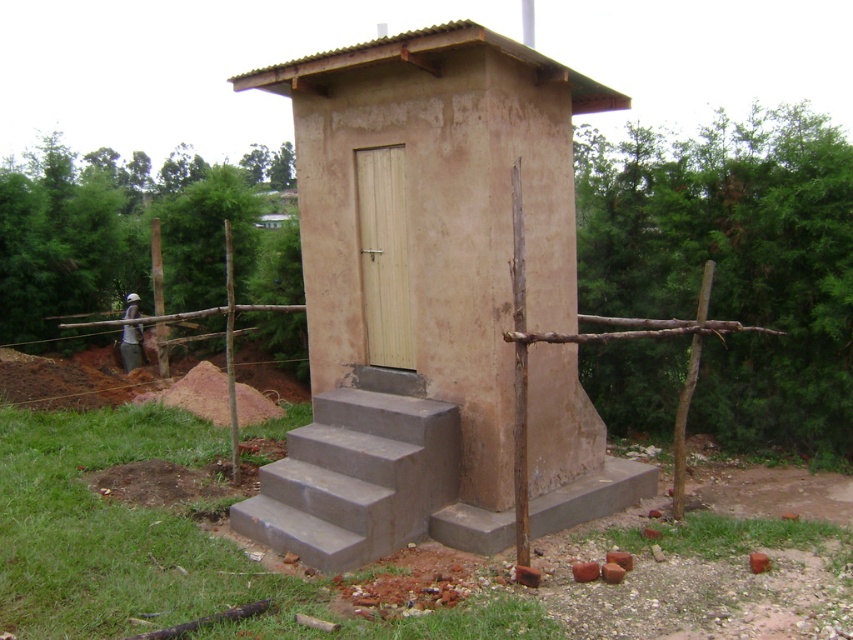
Who is higher up, gray concrete stairs at center or gray concrete steps at lower center?

gray concrete stairs at center is above.

Is gray concrete stairs at center thinner than gray concrete steps at lower center?

Indeed, gray concrete stairs at center has a lesser width compared to gray concrete steps at lower center.

Image resolution: width=853 pixels, height=640 pixels. I want to click on gray concrete stairs at center, so click(x=357, y=476).

Consider the image. Does matte concrete hut at center appear under gray concrete steps at lower center?

Incorrect, matte concrete hut at center is not positioned below gray concrete steps at lower center.

Between point (535, 250) and point (567, 509), which one is positioned behind?

The point (567, 509) is behind.

Describe the element at coordinates (418, 284) in the screenshot. I see `matte concrete hut at center` at that location.

The image size is (853, 640). I want to click on matte concrete hut at center, so click(418, 284).

Which of these two, matte concrete hut at center or gray concrete stairs at center, stands taller?

Standing taller between the two is matte concrete hut at center.

Can you confirm if matte concrete hut at center is positioned below gray concrete stairs at center?

No, matte concrete hut at center is not below gray concrete stairs at center.

Where is `matte concrete hut at center`? The width and height of the screenshot is (853, 640). matte concrete hut at center is located at coordinates [x=418, y=284].

Where is `matte concrete hut at center`? The width and height of the screenshot is (853, 640). matte concrete hut at center is located at coordinates (418, 284).